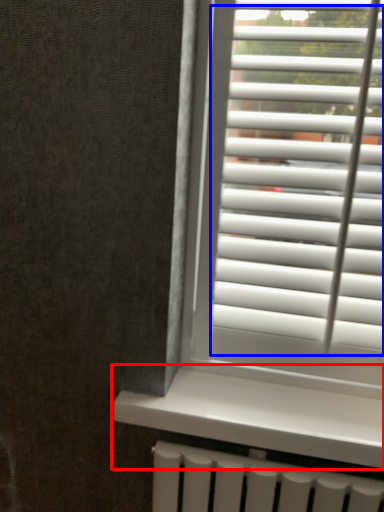
Question: Which point is further to the camera, window sill (highlighted by a red box) or blind (highlighted by a blue box)?

Choices:
 (A) window sill
 (B) blind

Answer: (A)